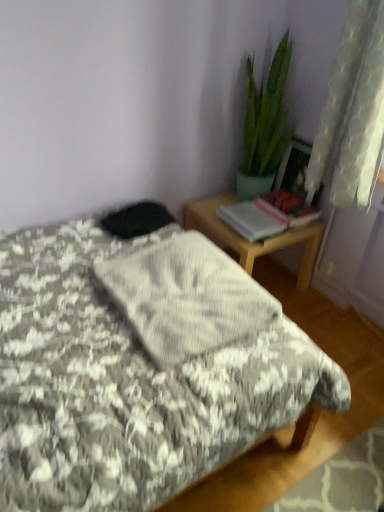
Question: Is gray textured blanket at center far from wooden desk at right?

Choices:
 (A) no
 (B) yes

Answer: (A)

Question: Does gray textured blanket at center lie behind wooden desk at right?

Choices:
 (A) yes
 (B) no

Answer: (B)

Question: Is gray textured blanket at center wider than wooden desk at right?

Choices:
 (A) yes
 (B) no

Answer: (B)

Question: Considering the relative sizes of gray textured blanket at center and wooden desk at right in the image provided, is gray textured blanket at center taller than wooden desk at right?

Choices:
 (A) no
 (B) yes

Answer: (A)

Question: Is gray textured blanket at center oriented away from wooden desk at right?

Choices:
 (A) no
 (B) yes

Answer: (A)

Question: From a real-world perspective, is wooden desk at right physically located above or below gray textured blanket at center?

Choices:
 (A) above
 (B) below

Answer: (B)

Question: In the image, is wooden desk at right positioned in front of or behind gray textured blanket at center?

Choices:
 (A) front
 (B) behind

Answer: (B)

Question: Looking at the image, does wooden desk at right seem bigger or smaller compared to gray textured blanket at center?

Choices:
 (A) small
 (B) big

Answer: (B)

Question: Looking at their shapes, would you say wooden desk at right is wider or thinner than gray textured blanket at center?

Choices:
 (A) wide
 (B) thin

Answer: (A)

Question: Is wooden desk at right taller or shorter than green glossy plant at upper right?

Choices:
 (A) short
 (B) tall

Answer: (A)

Question: From the image's perspective, is wooden desk at right above or below green glossy plant at upper right?

Choices:
 (A) below
 (B) above

Answer: (A)

Question: Considering the positions of wooden desk at right and green glossy plant at upper right in the image, is wooden desk at right wider or thinner than green glossy plant at upper right?

Choices:
 (A) wide
 (B) thin

Answer: (A)

Question: From a real-world perspective, is wooden desk at right positioned above or below green glossy plant at upper right?

Choices:
 (A) above
 (B) below

Answer: (B)

Question: Is gray textured blanket at center wider or thinner than wooden desk at right?

Choices:
 (A) thin
 (B) wide

Answer: (A)

Question: Considering the positions of gray textured blanket at center and wooden desk at right in the image, is gray textured blanket at center taller or shorter than wooden desk at right?

Choices:
 (A) short
 (B) tall

Answer: (A)